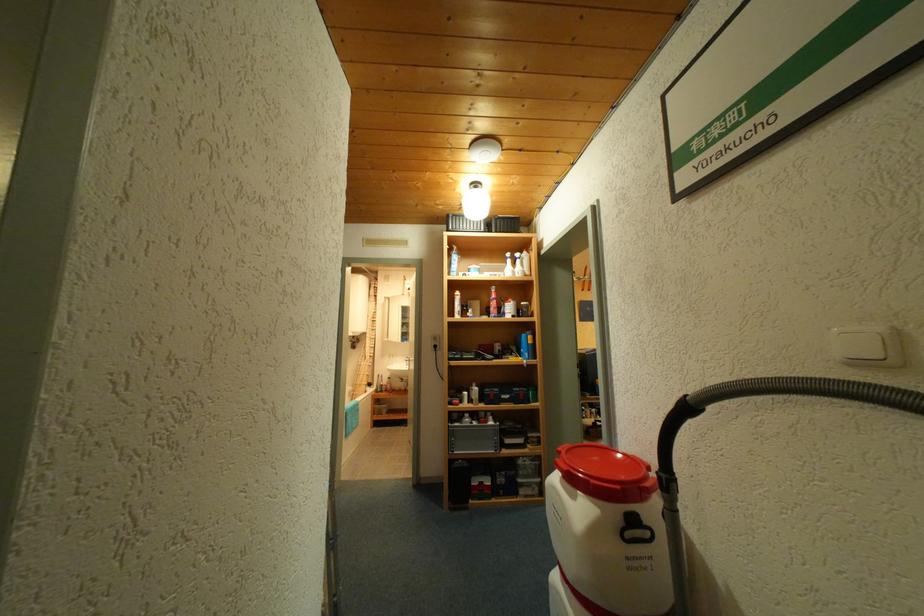
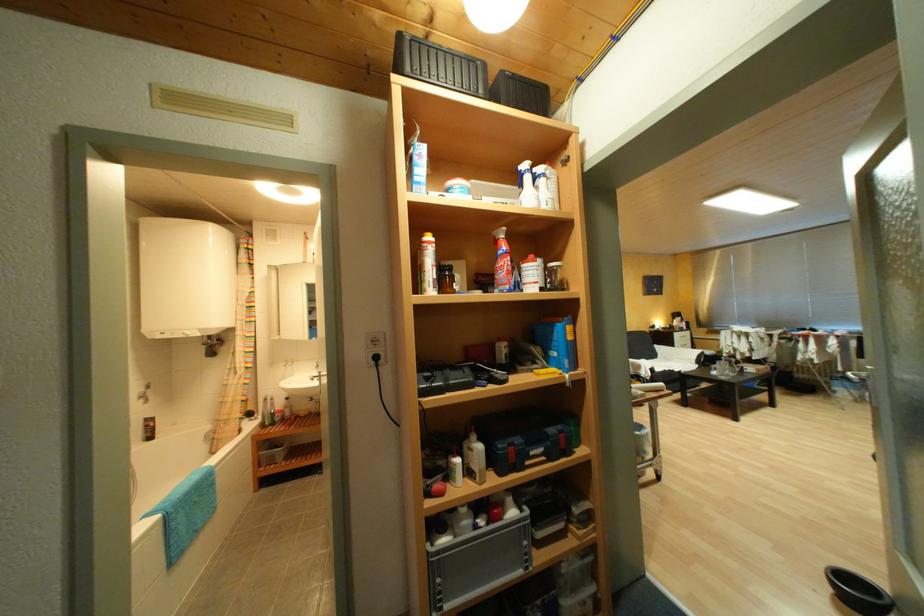
Locate, in the second image, the point that corresponds to (x=483, y=424) in the first image.

(491, 523)